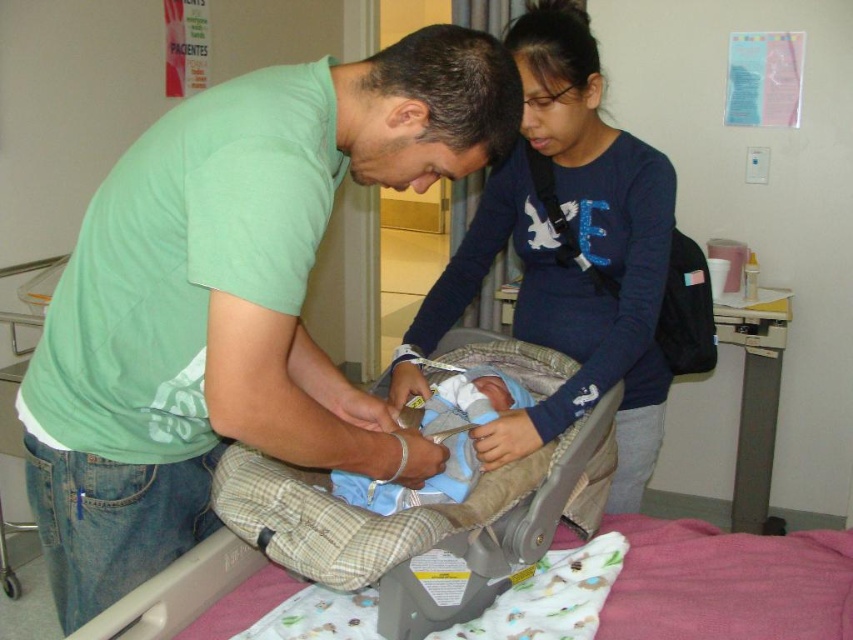
Is the position of green cotton shirt at center less distant than that of blue fabric newborn at center?

Yes, it is in front of blue fabric newborn at center.

Consider the image. Who is taller, green cotton shirt at center or blue fabric newborn at center?

With more height is green cotton shirt at center.

Locate an element on the screen. The width and height of the screenshot is (853, 640). green cotton shirt at center is located at coordinates (231, 300).

Find the location of a particular element. green cotton shirt at center is located at coordinates (231, 300).

Who is more distant from viewer, (x=596, y=464) or (x=335, y=484)?

Positioned behind is point (x=596, y=464).

Find the location of `soft beige fabric infant bed at center`. soft beige fabric infant bed at center is located at coordinates (728, 582).

Between point (433, 531) and point (471, 448), which one is positioned in front?

Point (433, 531) is in front.

What are the coordinates of `soft beige fabric infant bed at center` in the screenshot? It's located at (728, 582).

How far apart are green cotton shirt at center and soft beige fabric infant bed at center?

green cotton shirt at center is 11.60 inches away from soft beige fabric infant bed at center.

Does green cotton shirt at center have a lesser height compared to soft beige fabric infant bed at center?

In fact, green cotton shirt at center may be taller than soft beige fabric infant bed at center.

Between point (430, 52) and point (833, 540), which one is positioned behind?

The point (833, 540) is behind.

At what (x,y) coordinates should I click in order to perform the action: click on green cotton shirt at center. Please return your answer as a coordinate pair (x, y). Looking at the image, I should click on pos(231,300).